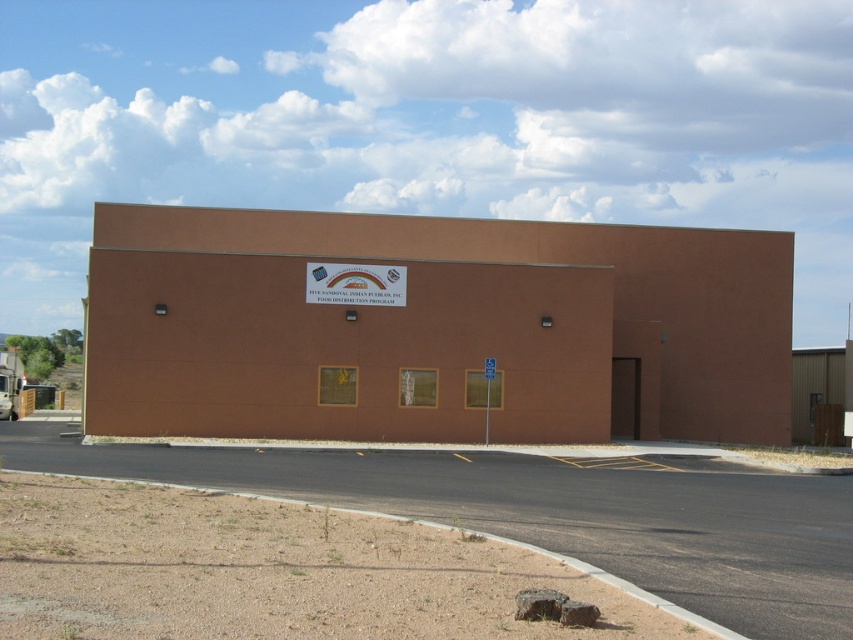
Measure the distance between point (399,348) and camera.

100.48 feet

Is matte brown building at center bigger than white plastic sign at center?

Yes.

Locate an element on the screen. matte brown building at center is located at coordinates (434, 328).